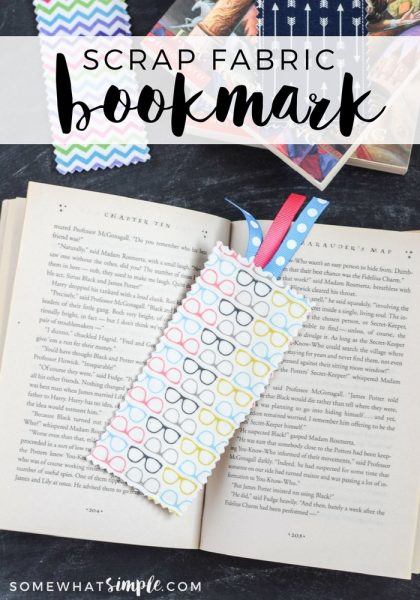
Find any what you use to mark you page in a book in the picture. Your answer should be formatted as a list of tuples, i.e. [(x1, y1), (x2, y2), ...], where each tuple contains the x and y coordinates of a point satisfying the conditions above.

[(198, 425)]